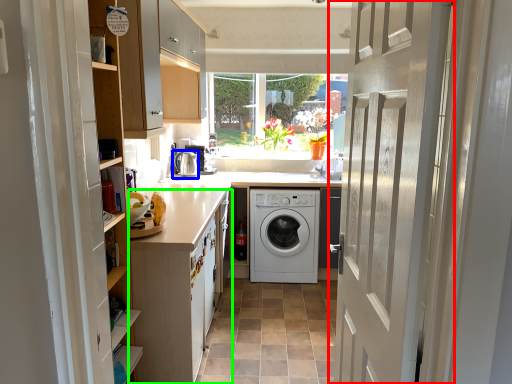
Question: Which is farther away from door (highlighted by a red box)? water heater (highlighted by a blue box) or cabinetry (highlighted by a green box)?

Choices:
 (A) water heater
 (B) cabinetry

Answer: (A)